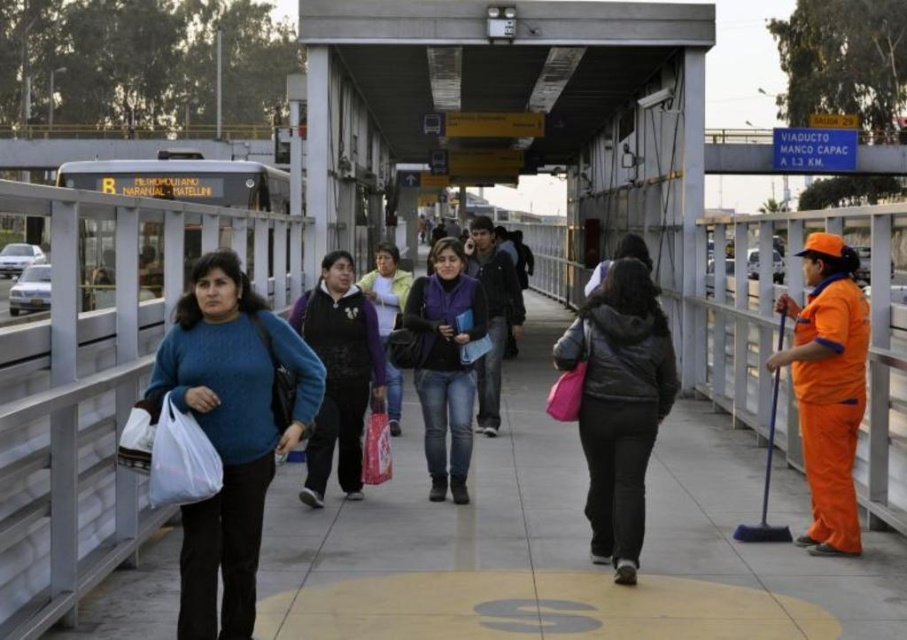
The width and height of the screenshot is (907, 640). Describe the element at coordinates (558, 541) in the screenshot. I see `matte concrete pavement at center` at that location.

Is matte concrete pavement at center positioned at the back of orange uniform at right?

No, it is in front of orange uniform at right.

This screenshot has height=640, width=907. Identify the location of matte concrete pavement at center. (558, 541).

From the picture: Who is more forward, (241, 572) or (629, 522)?

Point (241, 572) is more forward.

Is matte blue sweater at center above dark gray matte jacket at center?

Yes.

Image resolution: width=907 pixels, height=640 pixels. I want to click on matte blue sweater at center, so click(229, 433).

Which is more to the left, matte blue sweater at center or orange uniform at right?

From the viewer's perspective, matte blue sweater at center appears more on the left side.

Which is above, matte blue sweater at center or orange uniform at right?

Positioned higher is orange uniform at right.

Does point (254, 609) lie in front of point (801, 540)?

Yes, point (254, 609) is in front of point (801, 540).

At what (x,y) coordinates should I click in order to perform the action: click on matte blue sweater at center. Please return your answer as a coordinate pair (x, y). The image size is (907, 640). Looking at the image, I should click on coord(229,433).